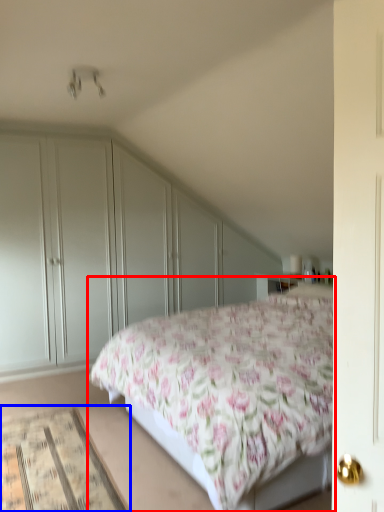
Question: Among these objects, which one is farthest to the camera, bed (highlighted by a red box) or mat (highlighted by a blue box)?

Choices:
 (A) bed
 (B) mat

Answer: (B)